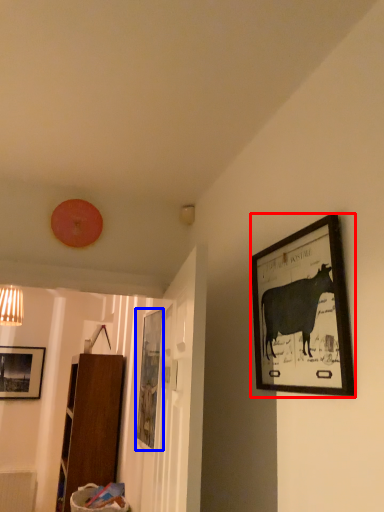
Question: Which object is further to the camera taking this photo, picture frame (highlighted by a red box) or picture frame (highlighted by a blue box)?

Choices:
 (A) picture frame
 (B) picture frame

Answer: (B)